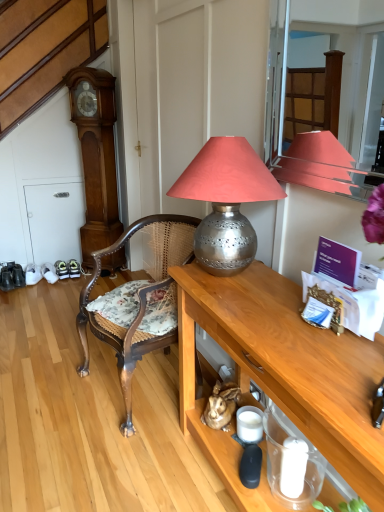
Question: Is point (89, 224) closer or farther from the camera than point (160, 261)?

Choices:
 (A) closer
 (B) farther

Answer: (B)

Question: Considering the positions of wooden grandfather clock at left and woven cane chair at center in the image, is wooden grandfather clock at left taller or shorter than woven cane chair at center?

Choices:
 (A) short
 (B) tall

Answer: (B)

Question: Based on their relative distances, which object is farther from the wooden table at center?

Choices:
 (A) translucent glass jar at lower right
 (B) woven cane chair at center
 (C) silver metallic lampshade at center
 (D) wooden grandfather clock at left

Answer: (D)

Question: Which is farther from the woven cane chair at center?

Choices:
 (A) silver metallic lampshade at center
 (B) wooden grandfather clock at left
 (C) wooden table at center
 (D) translucent glass jar at lower right

Answer: (B)